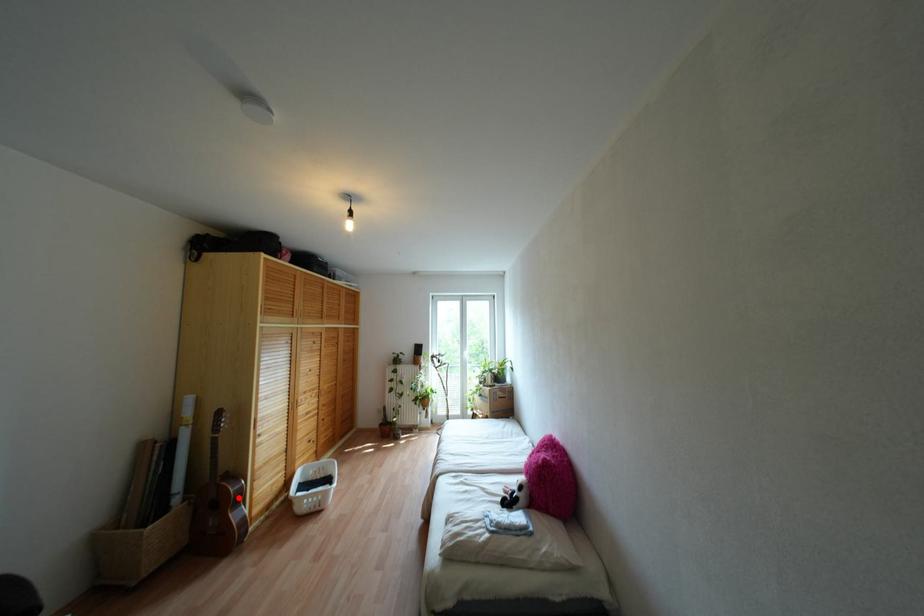
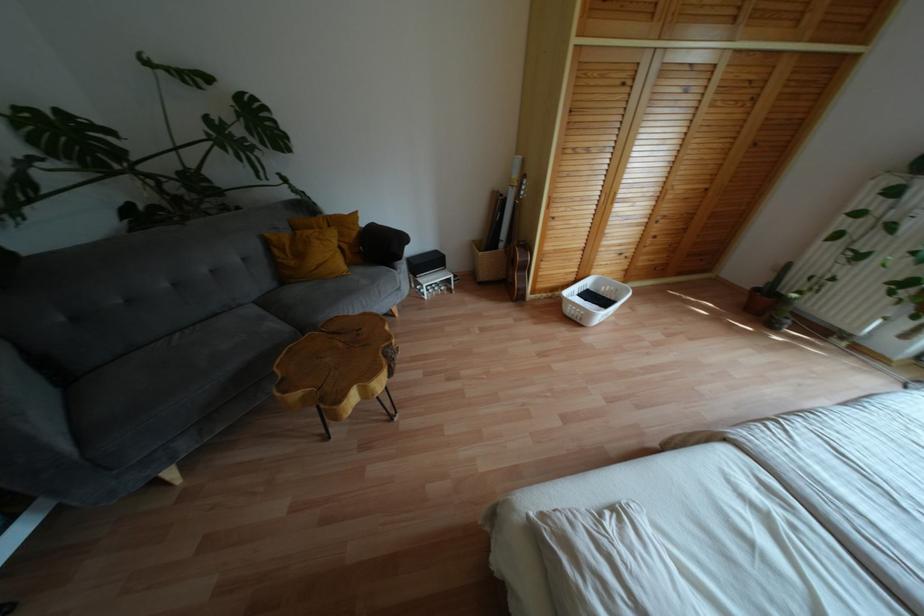
Question: I am providing you with two images of the same scene from different viewpoints. A red point is shown in image1. For the corresponding object point in image2, is it positioned nearer or farther from the camera?

Choices:
 (A) Nearer
 (B) Farther

Answer: (B)